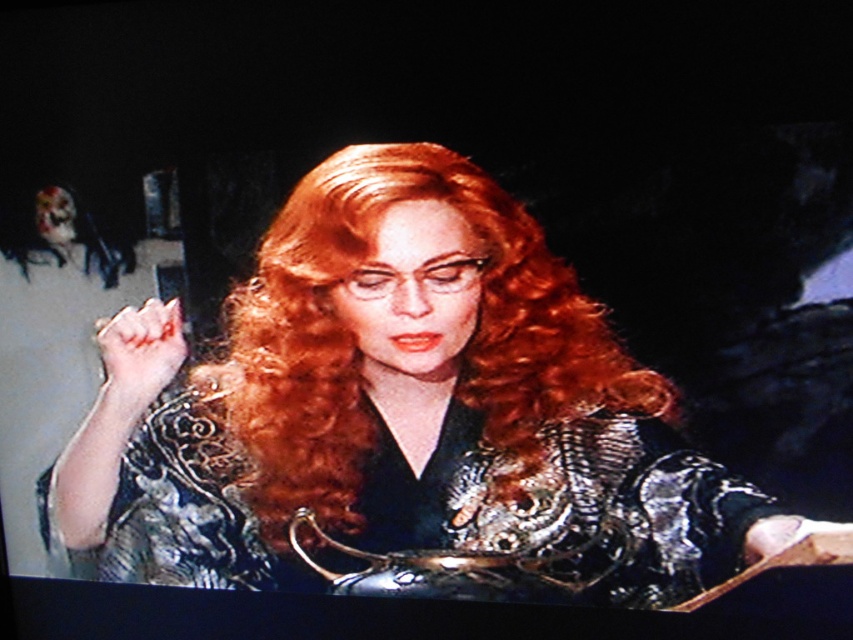
Question: Where is shiny silver armor at center located in relation to metallic silver dress at center in the image?

Choices:
 (A) left
 (B) right

Answer: (A)

Question: Can you confirm if shiny silver armor at center is bigger than metallic silver dress at center?

Choices:
 (A) no
 (B) yes

Answer: (B)

Question: Which point appears closest to the camera in this image?

Choices:
 (A) (398, 376)
 (B) (457, 422)

Answer: (B)

Question: Is shiny silver armor at center bigger than metallic silver dress at center?

Choices:
 (A) yes
 (B) no

Answer: (A)

Question: Among these objects, which one is farthest from the camera?

Choices:
 (A) shiny silver armor at center
 (B) metallic silver dress at center

Answer: (B)